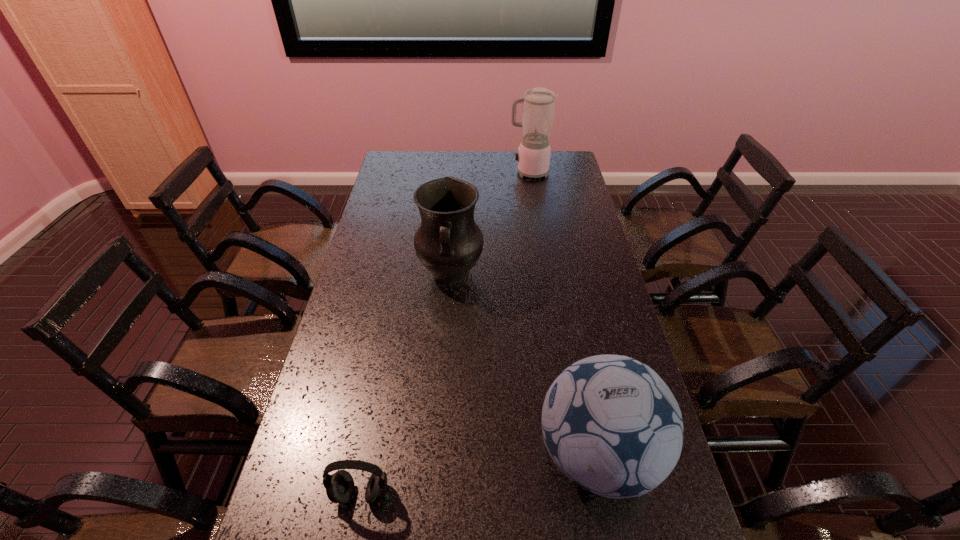
At what (x,y) coordinates should I click in order to perform the action: click on free space between the headset and the third nearest object. Please return your answer as a coordinate pair (x, y). This screenshot has height=540, width=960. Looking at the image, I should click on (406, 383).

Identify the location of unoccupied position between the food processor and the soccer ball. (564, 314).

Select which object is the closest to the soccer ball. Please provide its 2D coordinates. Your answer should be formatted as a tuple, i.e. [(x, y)], where the tuple contains the x and y coordinates of a point satisfying the conditions above.

[(340, 486)]

Locate which object is the second closest to the food processor. Please provide its 2D coordinates. Your answer should be formatted as a tuple, i.e. [(x, y)], where the tuple contains the x and y coordinates of a point satisfying the conditions above.

[(610, 423)]

Identify the location of vacant space that satisfies the following two spatial constraints: 1. on the base of the tallest object near the control knob; 2. on the ear cups of the shortest object. (580, 493).

Locate an element on the screen. The height and width of the screenshot is (540, 960). blank area in the image that satisfies the following two spatial constraints: 1. on the side with brand of the soccer ball; 2. on the ear cups of the headset is located at coordinates (606, 493).

Locate an element on the screen. vacant space that satisfies the following two spatial constraints: 1. on the side with brand of the soccer ball; 2. on the ear cups of the shortest object is located at coordinates (606, 493).

The image size is (960, 540). Identify the location of free space that satisfies the following two spatial constraints: 1. on the side with brand of the soccer ball; 2. on the ear cups of the headset. (606, 493).